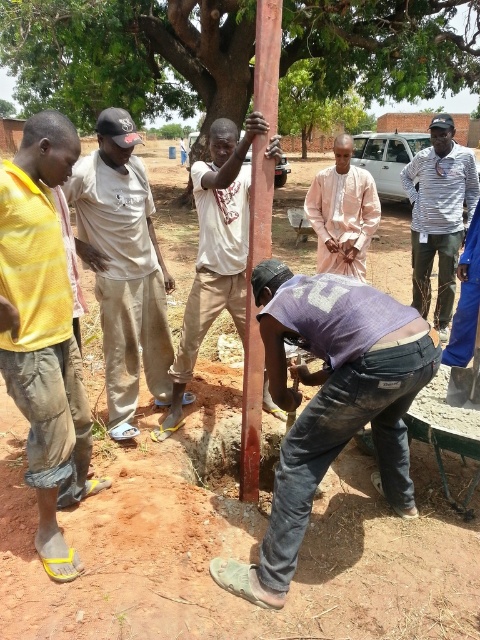
You are standing in the rural area shown in the image. You need to locate the worn denim jeans at lower center and the light brown cotton shirt at center. Which one is closer to you?

The worn denim jeans at lower center is in front of the light brown cotton shirt at center, so the worn denim jeans at lower center is closer to you.

You are standing at the center of the image and want to locate the worn denim jeans at lower center. Which direction should you look?

You should look downward because the worn denim jeans at lower center is located at point [331,403], which is below the center of the image.

You are a worker standing near the worn denim jeans at lower center and the smooth brown pole at center. Which object is shorter?

The worn denim jeans at lower center is shorter than the smooth brown pole at center.